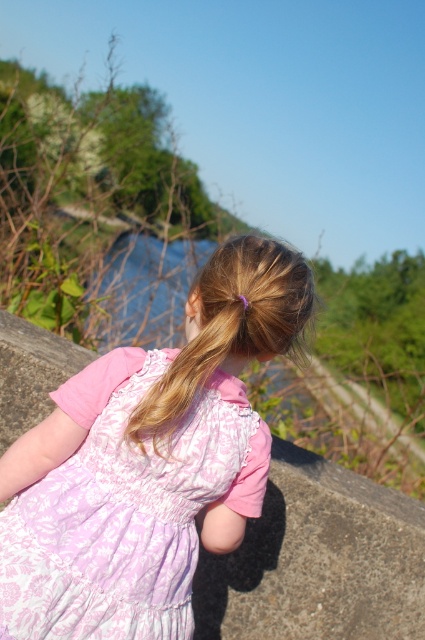
Question: Can you confirm if pink lace dress at center is positioned below blonde silky hair at center?

Choices:
 (A) no
 (B) yes

Answer: (B)

Question: Which of the following is the closest to the observer?

Choices:
 (A) (150, 524)
 (B) (172, 392)

Answer: (B)

Question: Is pink lace dress at center thinner than blonde silky hair at center?

Choices:
 (A) yes
 (B) no

Answer: (B)

Question: Can you confirm if pink lace dress at center is smaller than blonde silky hair at center?

Choices:
 (A) yes
 (B) no

Answer: (B)